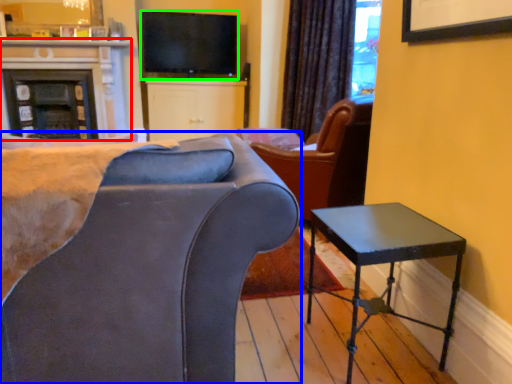
Question: Based on their relative distances, which object is nearer to fireplace (highlighted by a red box)? Choose from chair (highlighted by a blue box) and television (highlighted by a green box).

Choices:
 (A) chair
 (B) television

Answer: (B)